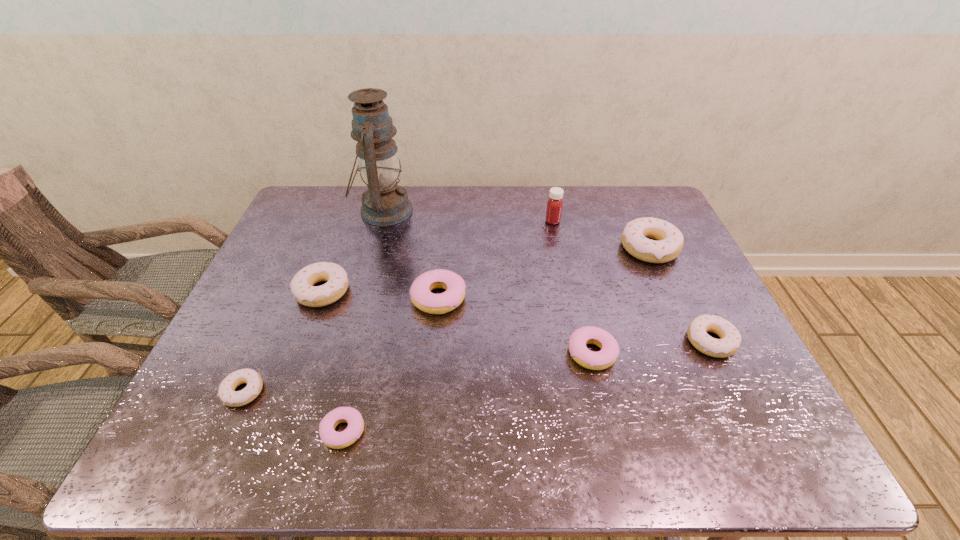
This screenshot has width=960, height=540. What are the coordinates of `vacant space that is in between the medicine and the second nearest white doughnut` in the screenshot? It's located at (632, 281).

This screenshot has height=540, width=960. Find the location of `free space that is in between the third biggest white doughnut and the eighth farthest object`. free space that is in between the third biggest white doughnut and the eighth farthest object is located at coordinates (477, 366).

Where is `free space that is in between the red medicine and the smallest pink doughnut`? Image resolution: width=960 pixels, height=540 pixels. free space that is in between the red medicine and the smallest pink doughnut is located at coordinates (448, 326).

Where is `empty space between the red medicine and the third nearest white doughnut`? empty space between the red medicine and the third nearest white doughnut is located at coordinates (438, 256).

Select which object is the third closest to the third farthest white doughnut. Please provide its 2D coordinates. Your answer should be formatted as a tuple, i.e. [(x, y)], where the tuple contains the x and y coordinates of a point satisfying the conditions above.

[(555, 203)]

Locate an element on the screen. The height and width of the screenshot is (540, 960). object that is the closest to the smallest pink doughnut is located at coordinates (227, 394).

Where is `doughnut that stands as the fourth closest to the smallest white doughnut`? The width and height of the screenshot is (960, 540). doughnut that stands as the fourth closest to the smallest white doughnut is located at coordinates (606, 357).

Locate an element on the screen. This screenshot has height=540, width=960. the closest doughnut to the third doughnut from right to left is located at coordinates (730, 341).

I want to click on white doughnut that can be found as the closest to the third biggest white doughnut, so click(x=670, y=240).

Identify which white doughnut is the second closest to the second biggest white doughnut. Please provide its 2D coordinates. Your answer should be formatted as a tuple, i.e. [(x, y)], where the tuple contains the x and y coordinates of a point satisfying the conditions above.

[(670, 240)]